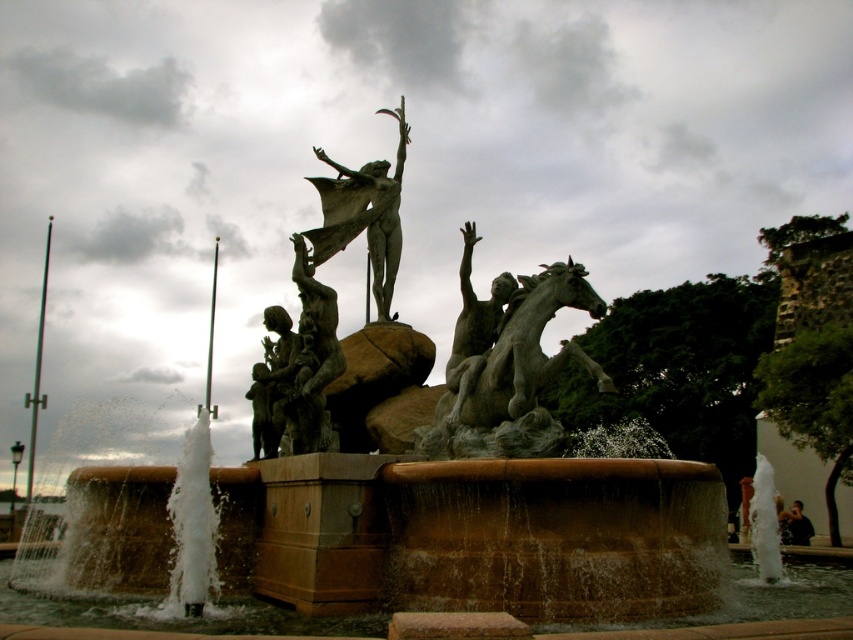
Is bronze statue group at center below black fabric person at lower right?

Actually, bronze statue group at center is above black fabric person at lower right.

Is point (317, 416) farther from camera compared to point (791, 509)?

That is False.

Who is more distant from viewer, (320, 317) or (780, 522)?

The point (780, 522) is more distant.

The height and width of the screenshot is (640, 853). What are the coordinates of `bronze statue group at center` in the screenshot? It's located at (296, 369).

Does bronze statue at center have a lesser width compared to black fabric person at lower right?

No, bronze statue at center is not thinner than black fabric person at lower right.

Is point (543, 372) behind point (793, 506)?

No.

Who is more forward, (497, 385) or (805, 528)?

Point (497, 385)

Image resolution: width=853 pixels, height=640 pixels. In order to click on bronze statue at center in this screenshot , I will do `click(508, 364)`.

Which is in front, point (453, 332) or point (796, 508)?

Point (453, 332) is more forward.

Which of these two, bronze statue of man at center or black fabric person at lower right, stands shorter?

black fabric person at lower right is shorter.

Is point (498, 275) more distant than point (782, 518)?

No, it is in front of (782, 518).

The image size is (853, 640). Identify the location of bronze statue of man at center. (473, 326).